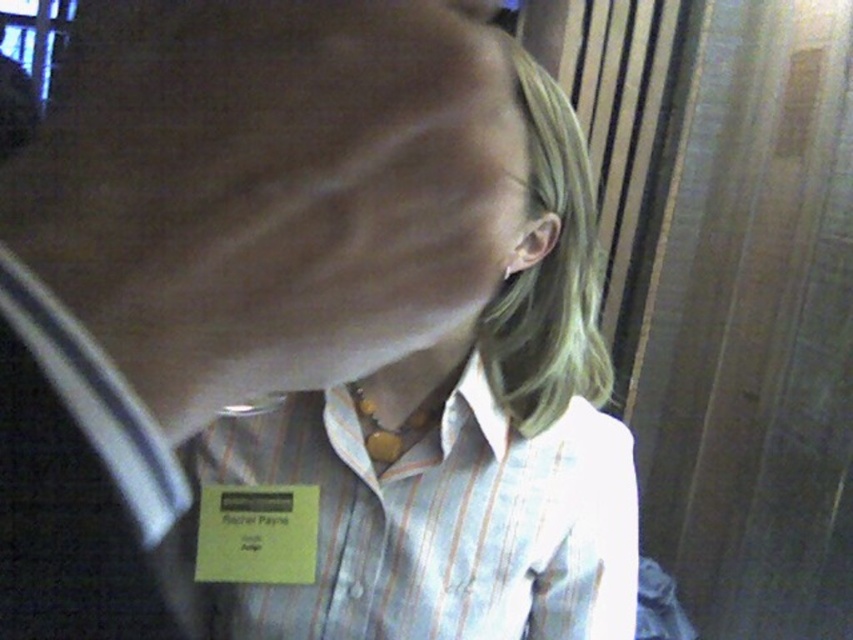
Question: Among these objects, which one is nearest to the camera?

Choices:
 (A) white striped dress shirt at center
 (B) white striped shirt at center

Answer: (B)

Question: Which point is closer to the camera?

Choices:
 (A) (422, 452)
 (B) (474, 556)

Answer: (A)

Question: Does white striped shirt at center have a greater width compared to white striped dress shirt at center?

Choices:
 (A) yes
 (B) no

Answer: (B)

Question: Is white striped shirt at center bigger than white striped dress shirt at center?

Choices:
 (A) yes
 (B) no

Answer: (A)

Question: From the image, what is the correct spatial relationship of white striped shirt at center in relation to white striped dress shirt at center?

Choices:
 (A) left
 (B) right

Answer: (B)

Question: Which point is closer to the camera?

Choices:
 (A) white striped dress shirt at center
 (B) white striped shirt at center

Answer: (B)